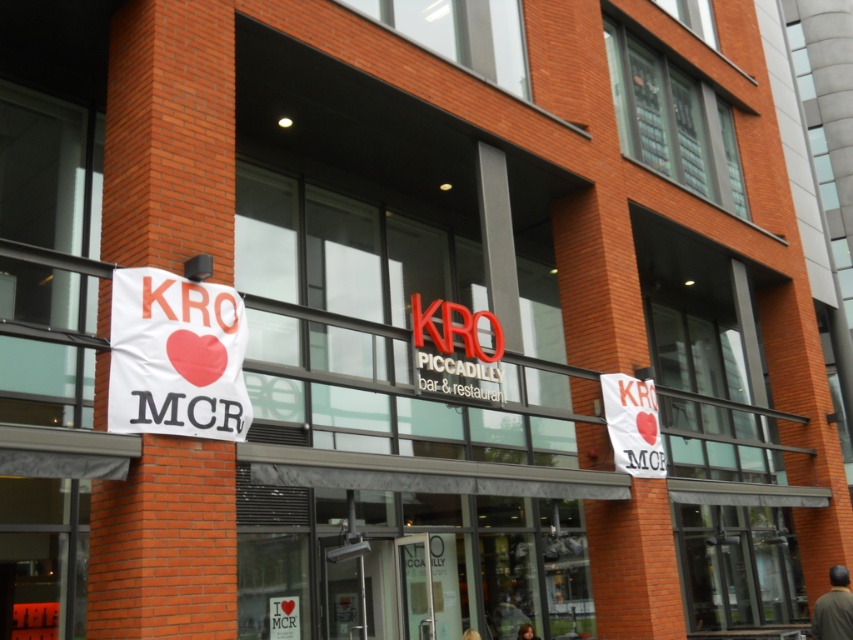
You are a customer standing in front of the building and want to read both banners. Which banner, the white paper banner at left or the white paper at center, is easier to see because it is closer to you?

The white paper banner at left is easier to see because it is in front of the white paper at center, making it closer to you.

You are a customer standing in front of the building and want to read both banners. Which banner, the white paper banner at left or the white paper banner at center, is easier to read from your current position?

The white paper banner at left is larger in size than the white paper banner at center, so it is easier to read from your current position.